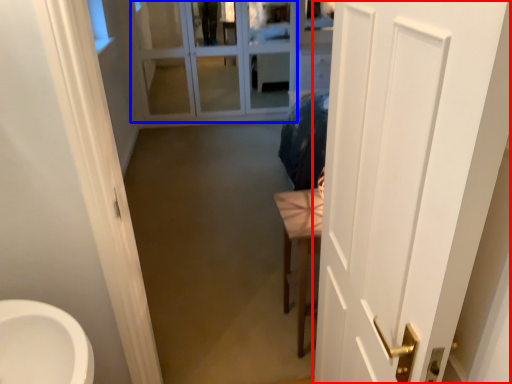
Question: Which point is closer to the camera, door (highlighted by a red box) or glass door (highlighted by a blue box)?

Choices:
 (A) door
 (B) glass door

Answer: (A)